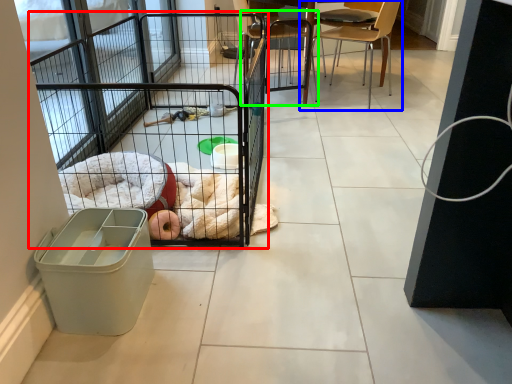
Question: Considering the real-world distances, which object is closest to cage (highlighted by a red box)? chair (highlighted by a blue box) or chair (highlighted by a green box).

Choices:
 (A) chair
 (B) chair

Answer: (B)